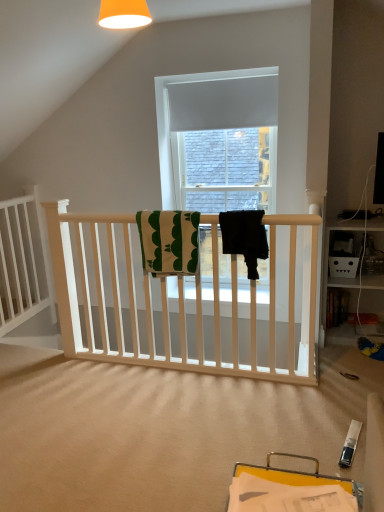
Question: Is white wooden bed frame at left beside green and white textured towel at center, the second beach towel when ordered from right to left?

Choices:
 (A) yes
 (B) no

Answer: (B)

Question: Is white wooden bed frame at left oriented towards green and white textured towel at center, marked as the 1th beach towel in a left-to-right arrangement?

Choices:
 (A) yes
 (B) no

Answer: (A)

Question: From a real-world perspective, is white wooden bed frame at left over green and white textured towel at center, the second beach towel when ordered from right to left?

Choices:
 (A) yes
 (B) no

Answer: (B)

Question: From a real-world perspective, is white wooden bed frame at left located beneath green and white textured towel at center, the second beach towel when ordered from right to left?

Choices:
 (A) yes
 (B) no

Answer: (A)

Question: Does white wooden bed frame at left appear on the right side of green and white textured towel at center, marked as the 1th beach towel in a left-to-right arrangement?

Choices:
 (A) no
 (B) yes

Answer: (A)

Question: Is white wooden bed frame at left wider than green and white textured towel at center, the second beach towel when ordered from right to left?

Choices:
 (A) no
 (B) yes

Answer: (A)

Question: Is green and white textured towel at center, marked as the 1th beach towel in a left-to-right arrangement, to the left of white wooden bed frame at left from the viewer's perspective?

Choices:
 (A) yes
 (B) no

Answer: (B)

Question: Considering the relative sizes of green and white textured towel at center, marked as the 1th beach towel in a left-to-right arrangement, and white wooden bed frame at left in the image provided, is green and white textured towel at center, marked as the 1th beach towel in a left-to-right arrangement, smaller than white wooden bed frame at left?

Choices:
 (A) no
 (B) yes

Answer: (B)

Question: Are green and white textured towel at center, the second beach towel when ordered from right to left, and white wooden bed frame at left located far from each other?

Choices:
 (A) yes
 (B) no

Answer: (A)

Question: Considering the relative positions of green and white textured towel at center, the second beach towel when ordered from right to left, and white wooden bed frame at left in the image provided, is green and white textured towel at center, the second beach towel when ordered from right to left, to the right of white wooden bed frame at left from the viewer's perspective?

Choices:
 (A) yes
 (B) no

Answer: (A)

Question: Can you confirm if green and white textured towel at center, marked as the 1th beach towel in a left-to-right arrangement, is wider than white wooden bed frame at left?

Choices:
 (A) no
 (B) yes

Answer: (B)

Question: Could white wooden bed frame at left be considered to be inside green and white textured towel at center, marked as the 1th beach towel in a left-to-right arrangement?

Choices:
 (A) no
 (B) yes

Answer: (A)

Question: Is black fabric towel at center, the 1th beach towel from the right, taller than green and white textured towel at center, the second beach towel when ordered from right to left?

Choices:
 (A) no
 (B) yes

Answer: (A)